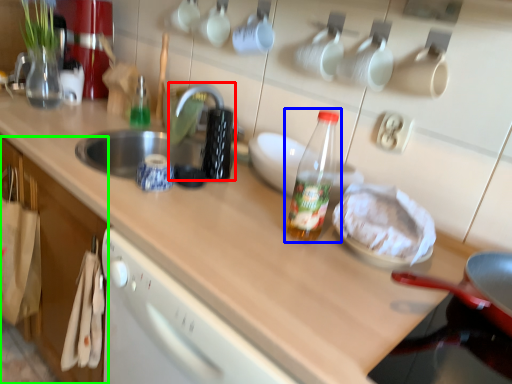
Question: Considering the real-world distances, which object is farthest from faucet (highlighted by a red box)? bottle (highlighted by a blue box) or cabinetry (highlighted by a green box)?

Choices:
 (A) bottle
 (B) cabinetry

Answer: (B)